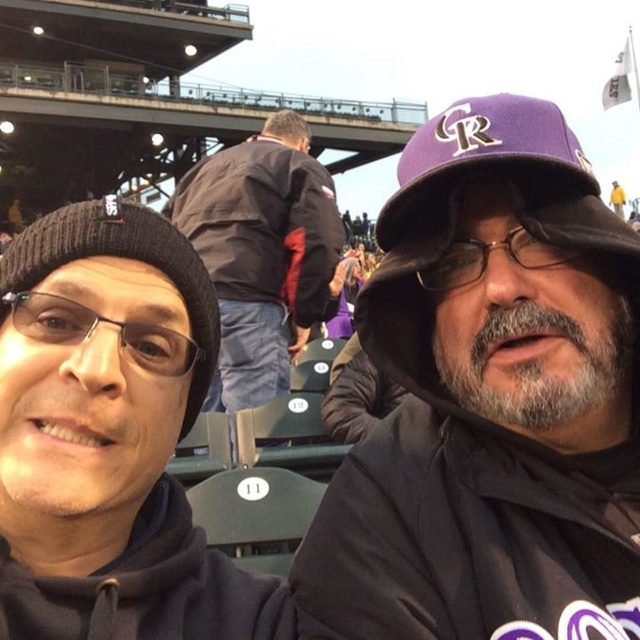
Is purple matte baseball cap at center below yellow fabric at upper right?

Indeed, purple matte baseball cap at center is positioned under yellow fabric at upper right.

Who is lower down, purple matte baseball cap at center or yellow fabric at upper right?

purple matte baseball cap at center

At what (x,y) coordinates should I click in order to perform the action: click on purple matte baseball cap at center. Please return your answer as a coordinate pair (x, y). Image resolution: width=640 pixels, height=640 pixels. Looking at the image, I should click on (490, 401).

Identify the location of purple matte baseball cap at center. (490, 401).

Can you confirm if transparent plastic glasses at left is smaller than black matte glasses at center?

Yes, transparent plastic glasses at left is smaller than black matte glasses at center.

Which is behind, point (168, 364) or point (508, 250)?

The point (508, 250) is more distant.

The width and height of the screenshot is (640, 640). I want to click on transparent plastic glasses at left, so click(x=96, y=326).

Can you confirm if black knit cap at upper left is positioned below yellow fabric at upper right?

Yes, black knit cap at upper left is below yellow fabric at upper right.

Between black knit cap at upper left and yellow fabric at upper right, which one has more height?

black knit cap at upper left

Where is `black knit cap at upper left`? black knit cap at upper left is located at coordinates (109, 445).

Where is `black knit cap at upper left`? black knit cap at upper left is located at coordinates (109, 445).